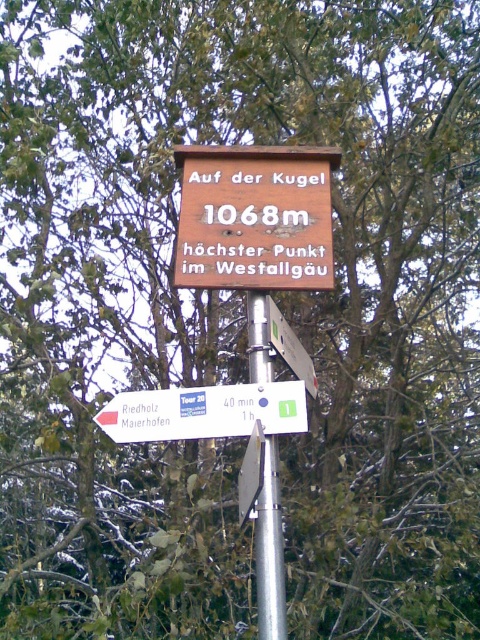
You are a hiker trying to read the signs on the signpost. You notice the white plastic sign at lower left and the silver metallic pole at center. Which object would block your view if you stand directly in front of the pole?

The white plastic sign at lower left might block your view because it could be wider than the silver metallic pole at center, potentially obscuring the view beyond the pole.

Based on the photo, you are a hiker trying to decide which sign to read first. The white plastic sign at lower left and the metallic silver sign at center are both important. Which one is shorter and thus might be easier to read from a distance?

The white plastic sign at lower left is shorter than the metallic silver sign at center, so it might be easier to read from a distance because it is smaller in height.